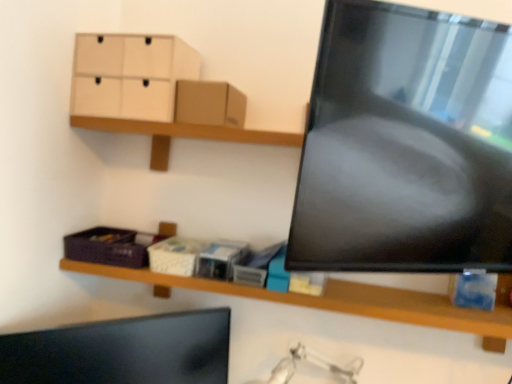
At what (x,y) coordinates should I click in order to perform the action: click on purple woven basket at lower left, the first storage box viewed from the left. Please return your answer as a coordinate pair (x, y). This screenshot has width=512, height=384. Looking at the image, I should click on (108, 247).

Image resolution: width=512 pixels, height=384 pixels. I want to click on matte black monitor at lower left, so click(123, 351).

Measure the distance between brown cardboard box at upper center and camera.

The distance of brown cardboard box at upper center from camera is 1.08 meters.

The image size is (512, 384). What do you see at coordinates (220, 259) in the screenshot?
I see `white matte storage box at center, acting as the 3th storage box starting from the left` at bounding box center [220, 259].

At what (x,y) coordinates should I click in order to perform the action: click on light beige cardboard drawer at upper left. Please return your answer as a coordinate pair (x, y). The width and height of the screenshot is (512, 384). Looking at the image, I should click on (130, 75).

Find the location of a particular element. purple woven basket at lower left, the third storage box when ordered from right to left is located at coordinates (108, 247).

Is white cardboard tissue box at center, which is the second storage box from right to left, to the right of matte black monitor at lower left from the viewer's perspective?

Correct, you'll find white cardboard tissue box at center, which is the second storage box from right to left, to the right of matte black monitor at lower left.

Between point (188, 273) and point (151, 377), which one is positioned behind?

The point (151, 377) is farther.

From the image's perspective, is white cardboard tissue box at center, which is the second storage box from right to left, above or below matte black monitor at lower left?

white cardboard tissue box at center, which is the second storage box from right to left, is above matte black monitor at lower left.

From a real-world perspective, is white cardboard tissue box at center, which is counted as the second storage box, starting from the left, positioned over brown cardboard box at upper center based on gravity?

No, from a real-world perspective, white cardboard tissue box at center, which is counted as the second storage box, starting from the left, is not over brown cardboard box at upper center

Consider the image. Is white cardboard tissue box at center, which is the second storage box from right to left, bigger than brown cardboard box at upper center?

No, white cardboard tissue box at center, which is the second storage box from right to left, is not bigger than brown cardboard box at upper center.

Locate an element on the screen. the 1st storage box directly beneath the brown cardboard box at upper center (from a real-world perspective) is located at coordinates (175, 256).

Can you see white cardboard tissue box at center, which is the second storage box from right to left, touching brown cardboard box at upper center?

white cardboard tissue box at center, which is the second storage box from right to left, and brown cardboard box at upper center are clearly separated.

Looking at this image, which of these two, purple woven basket at lower left, the first storage box viewed from the left, or white matte storage box at center, acting as the 3th storage box starting from the left, is bigger?

purple woven basket at lower left, the first storage box viewed from the left.

Is purple woven basket at lower left, the third storage box when ordered from right to left, not inside white matte storage box at center, acting as the 3th storage box starting from the left?

That's correct, purple woven basket at lower left, the third storage box when ordered from right to left, is outside of white matte storage box at center, acting as the 3th storage box starting from the left.

From the image's perspective, is purple woven basket at lower left, the third storage box when ordered from right to left, positioned above or below white matte storage box at center, marked as the 1th storage box in a right-to-left arrangement?

From the image's perspective, purple woven basket at lower left, the third storage box when ordered from right to left, appears above white matte storage box at center, marked as the 1th storage box in a right-to-left arrangement.

Is brown cardboard box at upper center beside light beige cardboard drawer at upper left?

No, brown cardboard box at upper center is not making contact with light beige cardboard drawer at upper left.

Looking at this image, from the image's perspective, is brown cardboard box at upper center located above light beige cardboard drawer at upper left?

Actually, brown cardboard box at upper center appears below light beige cardboard drawer at upper left in the image.

From a real-world perspective, is brown cardboard box at upper center below light beige cardboard drawer at upper left?

Yes, from a real-world perspective, brown cardboard box at upper center is under light beige cardboard drawer at upper left.

Is white matte storage box at center, marked as the 1th storage box in a right-to-left arrangement, facing away from wooden shelf at lower center?

Correct, white matte storage box at center, marked as the 1th storage box in a right-to-left arrangement, is looking away from wooden shelf at lower center.

Is point (225, 270) positioned behind point (503, 290)?

No, (225, 270) is in front of (503, 290).

Is white matte storage box at center, marked as the 1th storage box in a right-to-left arrangement, not close to wooden shelf at lower center?

No, white matte storage box at center, marked as the 1th storage box in a right-to-left arrangement, is not far from wooden shelf at lower center.

Could you tell me if light beige cardboard drawer at upper left is turned towards white cardboard tissue box at center, which is counted as the second storage box, starting from the left?

No, light beige cardboard drawer at upper left is not oriented towards white cardboard tissue box at center, which is counted as the second storage box, starting from the left.

Which object is thinner, light beige cardboard drawer at upper left or white cardboard tissue box at center, which is the second storage box from right to left?

With smaller width is white cardboard tissue box at center, which is the second storage box from right to left.

Consider the image. Considering the relative sizes of light beige cardboard drawer at upper left and white cardboard tissue box at center, which is the second storage box from right to left, in the image provided, is light beige cardboard drawer at upper left shorter than white cardboard tissue box at center, which is the second storage box from right to left,?

In fact, light beige cardboard drawer at upper left may be taller than white cardboard tissue box at center, which is the second storage box from right to left.

From the image's perspective, count 2nd storage boxs downward from the light beige cardboard drawer at upper left and point to it. Please provide its 2D coordinates.

[(175, 256)]

From a real-world perspective, which object stands above the other?

From a 3D spatial view, wooden shelf at lower center is above.

Based on the photo, how different are the orientations of wooden shelf at lower center and matte black monitor at lower left in degrees?

The facing directions of wooden shelf at lower center and matte black monitor at lower left are 42.5 degrees apart.

Would you say wooden shelf at lower center is to the left or to the right of matte black monitor at lower left in the picture?

From the image, it's evident that wooden shelf at lower center is to the right of matte black monitor at lower left.

Locate an element on the screen. Image resolution: width=512 pixels, height=384 pixels. computer monitor that is below the white cardboard tissue box at center, which is the second storage box from right to left (from the image's perspective) is located at coordinates (123, 351).

Locate an element on the screen. The height and width of the screenshot is (384, 512). cardboard box above the white cardboard tissue box at center, which is the second storage box from right to left (from a real-world perspective) is located at coordinates (209, 103).

Which object lies further to the anchor point wooden shelf at lower center, matte black monitor at lower left or light beige cardboard drawer at upper left?

The object further to wooden shelf at lower center is light beige cardboard drawer at upper left.

Estimate the real-world distances between objects in this image. Which object is further from wooden shelf at lower center, white cardboard tissue box at center, which is counted as the second storage box, starting from the left, or matte black monitor at lower left?

white cardboard tissue box at center, which is counted as the second storage box, starting from the left.

Estimate the real-world distances between objects in this image. Which object is further from wooden shelf at lower center, white matte storage box at center, marked as the 1th storage box in a right-to-left arrangement, or light beige cardboard drawer at upper left?

Among the two, light beige cardboard drawer at upper left is located further to wooden shelf at lower center.

Estimate the real-world distances between objects in this image. Which object is further from light beige cardboard drawer at upper left, wooden shelf at lower center or white cardboard tissue box at center, which is counted as the second storage box, starting from the left?

Among the two, wooden shelf at lower center is located further to light beige cardboard drawer at upper left.

Looking at the image, which one is located further to white cardboard tissue box at center, which is the second storage box from right to left, matte black monitor at lower left or light beige cardboard drawer at upper left?

light beige cardboard drawer at upper left is positioned further to the anchor white cardboard tissue box at center, which is the second storage box from right to left.

Looking at the image, which one is located further to brown cardboard box at upper center, wooden shelf at lower center or purple woven basket at lower left, the first storage box viewed from the left?

wooden shelf at lower center.

When comparing their distances from white cardboard tissue box at center, which is the second storage box from right to left, does wooden shelf at lower center or white matte storage box at center, acting as the 3th storage box starting from the left, seem further?

The object further to white cardboard tissue box at center, which is the second storage box from right to left, is wooden shelf at lower center.

Looking at the image, which one is located closer to white matte storage box at center, marked as the 1th storage box in a right-to-left arrangement, white cardboard tissue box at center, which is counted as the second storage box, starting from the left, or matte black monitor at lower left?

Among the two, white cardboard tissue box at center, which is counted as the second storage box, starting from the left, is located nearer to white matte storage box at center, marked as the 1th storage box in a right-to-left arrangement.

This screenshot has height=384, width=512. Identify the location of cardboard box between light beige cardboard drawer at upper left and white cardboard tissue box at center, which is counted as the second storage box, starting from the left, in the vertical direction. (209, 103).

I want to click on cardboard box between light beige cardboard drawer at upper left and wooden shelf at lower center in the up-down direction, so click(209, 103).

I want to click on storage box between brown cardboard box at upper center and white cardboard tissue box at center, which is the second storage box from right to left, from top to bottom, so click(108, 247).

Find the location of a particular element. The height and width of the screenshot is (384, 512). shelf between brown cardboard box at upper center and matte black monitor at lower left vertically is located at coordinates (343, 301).